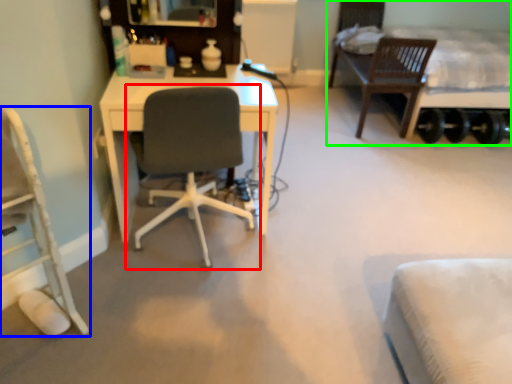
Question: Based on their relative distances, which object is nearer to chair (highlighted by a red box)? Choose from chair (highlighted by a blue box) and bed (highlighted by a green box).

Choices:
 (A) chair
 (B) bed

Answer: (A)